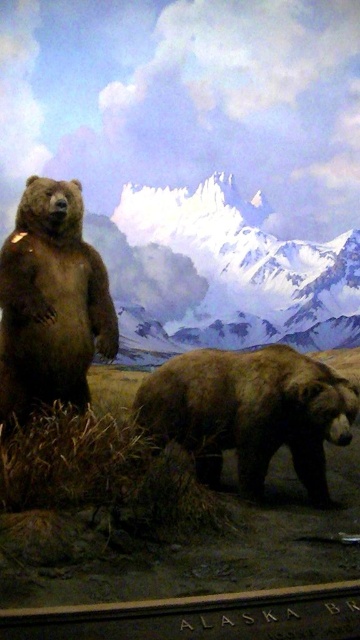
Question: Is sandy brown fur at left thinner than shiny brown bear at left?

Choices:
 (A) yes
 (B) no

Answer: (B)

Question: Can you confirm if sandy brown fur at left is thinner than shiny brown bear at left?

Choices:
 (A) yes
 (B) no

Answer: (B)

Question: Does sandy brown fur at left have a larger size compared to shiny brown bear at left?

Choices:
 (A) no
 (B) yes

Answer: (B)

Question: Which point is farther to the camera?

Choices:
 (A) shiny brown bear at left
 (B) brown fuzzy bear at center

Answer: (A)

Question: Which of the following is the closest to the observer?

Choices:
 (A) sandy brown fur at left
 (B) brown fuzzy bear at center

Answer: (B)

Question: Among these objects, which one is nearest to the camera?

Choices:
 (A) shiny brown bear at left
 (B) sandy brown fur at left
 (C) brown fuzzy bear at center

Answer: (C)